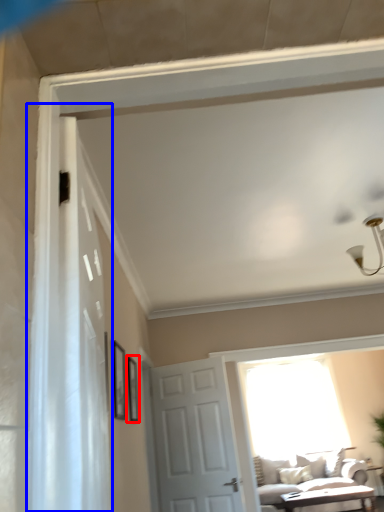
Question: Among these objects, which one is nearest to the camera, picture frame (highlighted by a red box) or shower curtain (highlighted by a blue box)?

Choices:
 (A) picture frame
 (B) shower curtain

Answer: (B)